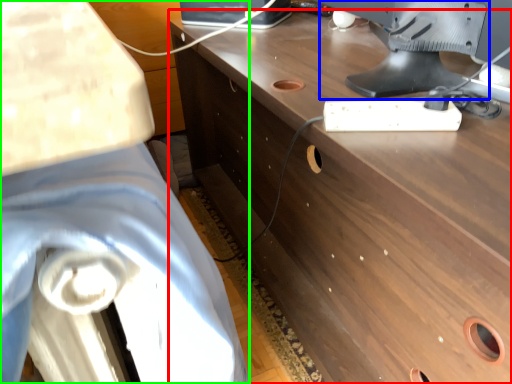
Question: Estimate the real-world distances between objects in this image. Which object is closer to desk (highlighted by a red box), computer monitor (highlighted by a blue box) or swivel chair (highlighted by a green box)?

Choices:
 (A) computer monitor
 (B) swivel chair

Answer: (A)